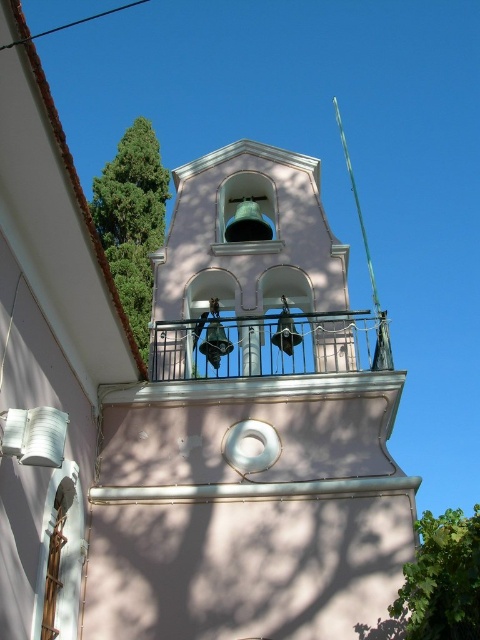
Question: Which of these objects is positioned closest to the pink matte bell tower at center?

Choices:
 (A) green leafy tree at upper left
 (B) metallic silver balcony at center

Answer: (B)

Question: Is pink matte bell tower at center below green leafy tree at upper left?

Choices:
 (A) yes
 (B) no

Answer: (A)

Question: Does pink matte bell tower at center appear over green leafy tree at upper left?

Choices:
 (A) yes
 (B) no

Answer: (B)

Question: In this image, where is metallic silver balcony at center located relative to green leafy tree at lower right?

Choices:
 (A) right
 (B) left

Answer: (B)

Question: Among these objects, which one is farthest from the camera?

Choices:
 (A) green leafy tree at upper left
 (B) metallic silver balcony at center
 (C) green leafy tree at lower right
 (D) pink matte bell tower at center

Answer: (D)

Question: Which object is the farthest from the green leafy tree at lower right?

Choices:
 (A) pink matte bell tower at center
 (B) metallic silver balcony at center
 (C) green leafy tree at upper left

Answer: (C)